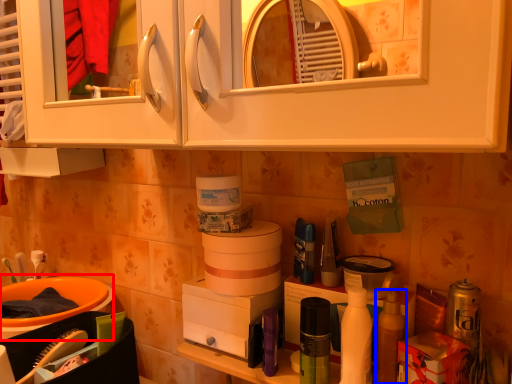
Question: Which object is further to the camera taking this photo, sink (highlighted by a red box) or mouthwash (highlighted by a blue box)?

Choices:
 (A) sink
 (B) mouthwash

Answer: (A)